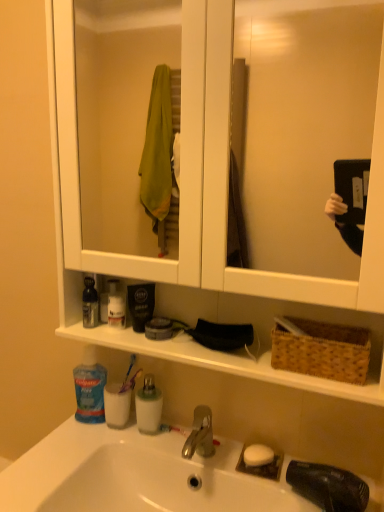
Find the location of a particular element. free space in front of purple plastic toothbrush at lower center is located at coordinates (112, 439).